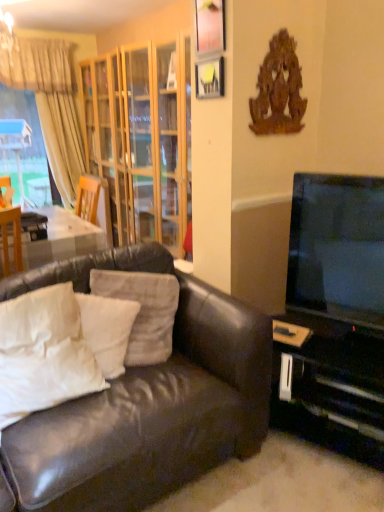
Question: Is white soft pillow at left, the 3th pillow in the right-to-left sequence, bigger or smaller than beige fabric curtain at upper left?

Choices:
 (A) big
 (B) small

Answer: (B)

Question: Would you say white soft pillow at left, the 3th pillow in the right-to-left sequence, is to the left or to the right of beige fabric curtain at upper left in the picture?

Choices:
 (A) right
 (B) left

Answer: (A)

Question: Which object is positioned farthest from the black plastic entertainment center at right?

Choices:
 (A) matte yellow picture frame at upper center, acting as the 1th picture frame starting from the bottom
 (B) wooden picture frame at upper center, which ranks as the first picture frame in top-to-bottom order
 (C) leather couch at lower left
 (D) light wood/glass cabinet at upper left
 (E) white soft pillow at left, the 3th pillow in the right-to-left sequence

Answer: (D)

Question: Estimate the real-world distances between objects in this image. Which object is closer to the wooden picture frame at upper center, which ranks as the first picture frame in top-to-bottom order?

Choices:
 (A) black plastic entertainment center at right
 (B) flat screen tv at right
 (C) leather couch at lower left
 (D) white soft pillow at center, the second pillow in the right-to-left sequence
 (E) matte yellow picture frame at upper center, acting as the 1th picture frame starting from the bottom

Answer: (E)